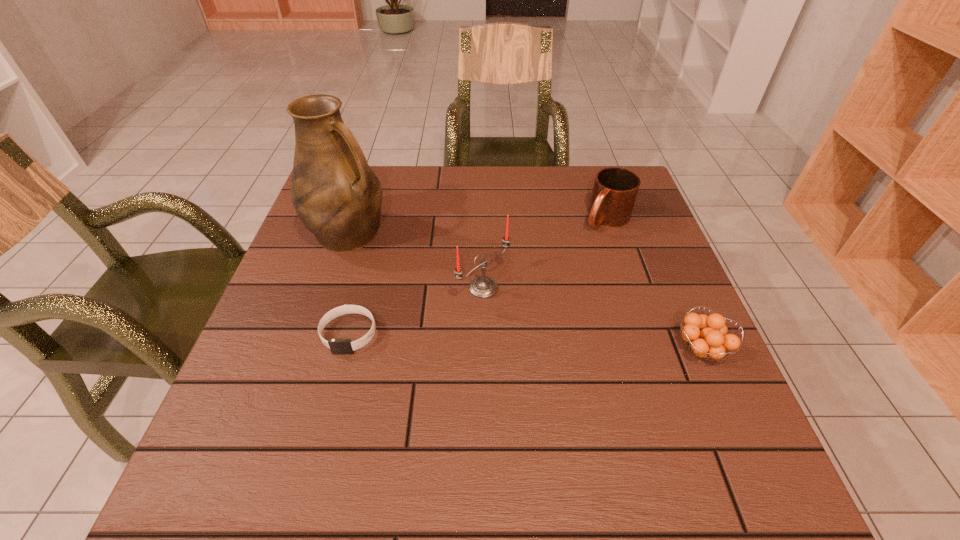
Find the location of a particular element. This screenshot has width=960, height=540. free space located on the handle side of the tallest object is located at coordinates (409, 269).

Locate an element on the screen. This screenshot has width=960, height=540. vacant space situated on the front-facing side of the third nearest object is located at coordinates [542, 329].

This screenshot has height=540, width=960. What are the coordinates of `free location located 0.210m on the front-facing side of the third nearest object` in the screenshot? It's located at (582, 358).

Locate an element on the screen. free location located 0.200m on the front-facing side of the third nearest object is located at coordinates (578, 355).

Find the location of `free region located 0.100m on the side of the third tallest object with the handle`. free region located 0.100m on the side of the third tallest object with the handle is located at coordinates (573, 251).

The height and width of the screenshot is (540, 960). What are the coordinates of `blank space located on the side of the third tallest object with the handle` in the screenshot? It's located at (543, 280).

Where is `vacant space located on the side of the third tallest object with the handle`? Image resolution: width=960 pixels, height=540 pixels. vacant space located on the side of the third tallest object with the handle is located at coordinates (533, 289).

The height and width of the screenshot is (540, 960). I want to click on pitcher that is at the far edge, so click(x=336, y=195).

This screenshot has width=960, height=540. In order to click on mug situated at the far edge in this screenshot , I will do `click(615, 190)`.

Identify the location of wristband at the left edge. Image resolution: width=960 pixels, height=540 pixels. click(338, 346).